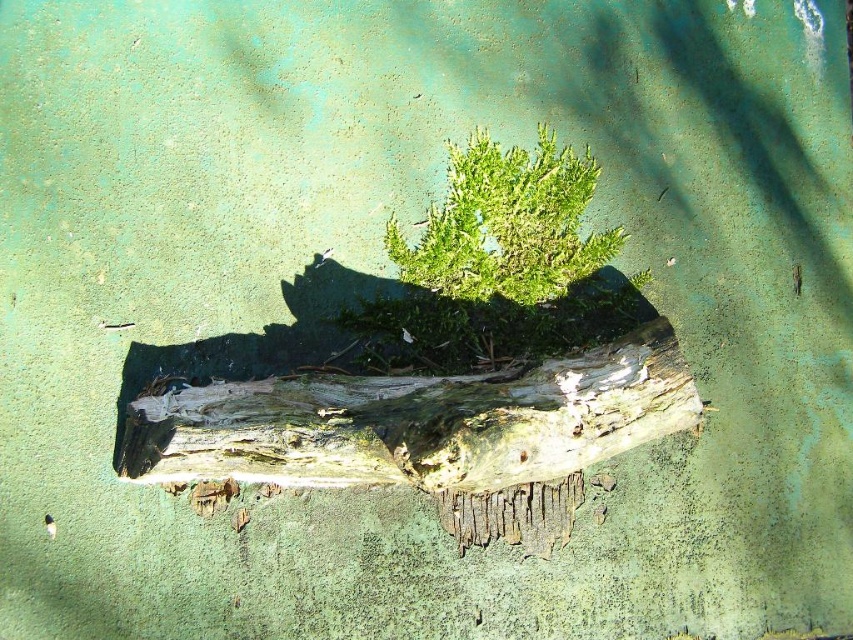
Between weathered wood log at center and green fuzzy fern at center, which one has more height?

Standing taller between the two is weathered wood log at center.

What do you see at coordinates (427, 433) in the screenshot?
I see `weathered wood log at center` at bounding box center [427, 433].

This screenshot has width=853, height=640. Identify the location of weathered wood log at center. 427,433.